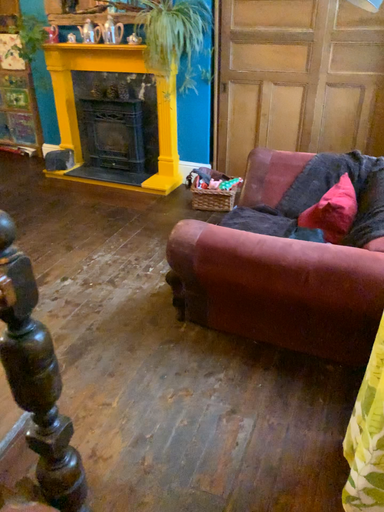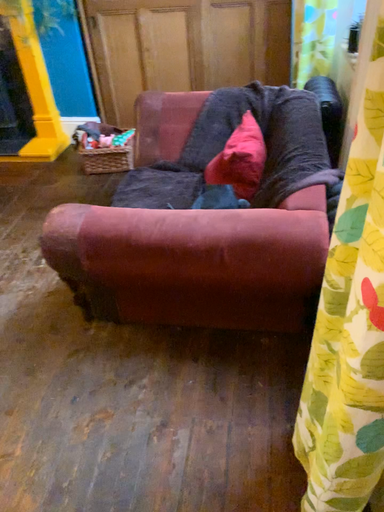
Question: Which way did the camera rotate in the video?

Choices:
 (A) rotated upward
 (B) rotated downward

Answer: (B)